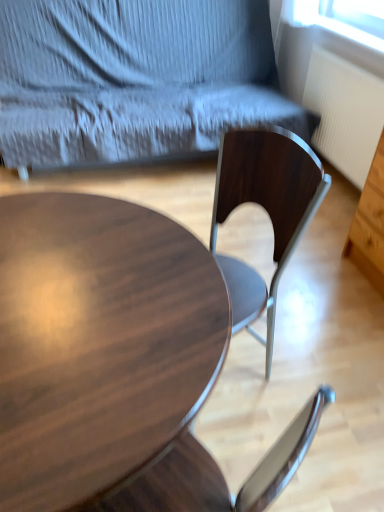
Question: Is white ribbed radiator at right further to camera compared to shiny dark wood coffee table at center?

Choices:
 (A) yes
 (B) no

Answer: (A)

Question: Does white ribbed radiator at right appear on the right side of shiny dark wood coffee table at center?

Choices:
 (A) yes
 (B) no

Answer: (A)

Question: From the image's perspective, is white ribbed radiator at right over shiny dark wood coffee table at center?

Choices:
 (A) no
 (B) yes

Answer: (B)

Question: From a real-world perspective, does white ribbed radiator at right sit lower than shiny dark wood coffee table at center?

Choices:
 (A) yes
 (B) no

Answer: (A)

Question: Does white ribbed radiator at right have a lesser height compared to shiny dark wood coffee table at center?

Choices:
 (A) yes
 (B) no

Answer: (A)

Question: Considering the relative positions of wooden chair at center and white ribbed radiator at right in the image provided, is wooden chair at center to the left or to the right of white ribbed radiator at right?

Choices:
 (A) right
 (B) left

Answer: (B)

Question: Would you say wooden chair at center is inside or outside white ribbed radiator at right?

Choices:
 (A) outside
 (B) inside

Answer: (A)

Question: From a real-world perspective, relative to white ribbed radiator at right, is wooden chair at center vertically above or below?

Choices:
 (A) above
 (B) below

Answer: (A)

Question: Is wooden chair at center bigger or smaller than white ribbed radiator at right?

Choices:
 (A) big
 (B) small

Answer: (A)

Question: From a real-world perspective, is wooden chair at center positioned above or below shiny dark wood coffee table at center?

Choices:
 (A) below
 (B) above

Answer: (B)

Question: Considering the positions of wooden chair at center and shiny dark wood coffee table at center in the image, is wooden chair at center wider or thinner than shiny dark wood coffee table at center?

Choices:
 (A) wide
 (B) thin

Answer: (A)

Question: Would you say wooden chair at center is to the left or to the right of shiny dark wood coffee table at center in the picture?

Choices:
 (A) right
 (B) left

Answer: (A)

Question: Based on their sizes in the image, would you say wooden chair at center is bigger or smaller than shiny dark wood coffee table at center?

Choices:
 (A) small
 (B) big

Answer: (B)

Question: From their relative heights in the image, would you say shiny dark wood coffee table at center is taller or shorter than wooden chair at center?

Choices:
 (A) tall
 (B) short

Answer: (B)

Question: From the image's perspective, is shiny dark wood coffee table at center positioned above or below wooden chair at center?

Choices:
 (A) above
 (B) below

Answer: (B)